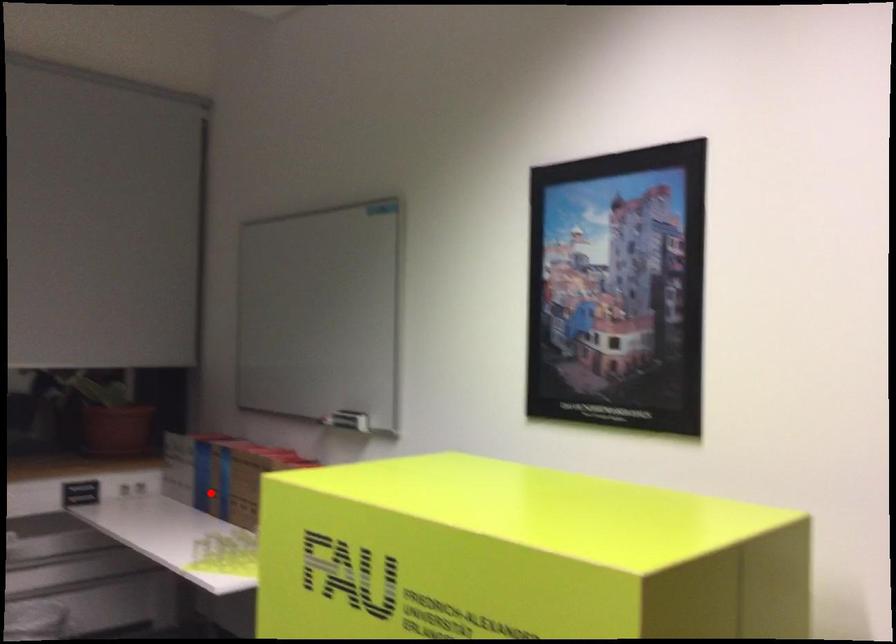
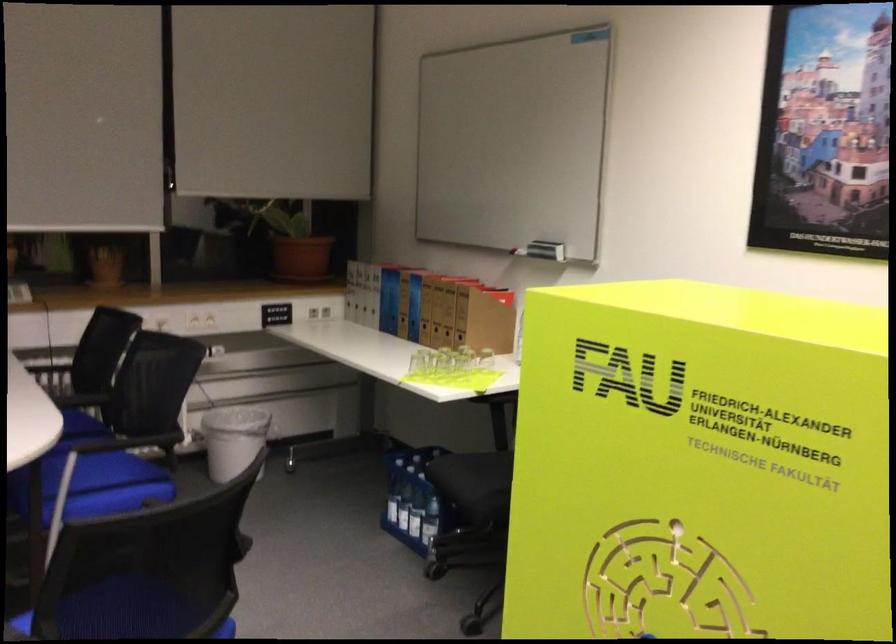
The point at the highlighted location is marked in the first image. Where is the corresponding point in the second image?

(398, 317)